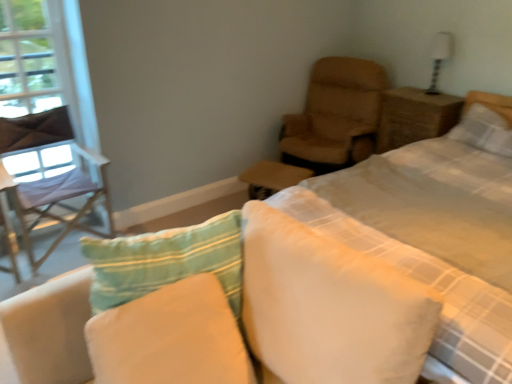
Locate an element on the screen. blank space above brown wicker nightstand at upper right (from a real-world perspective) is located at coordinates (418, 95).